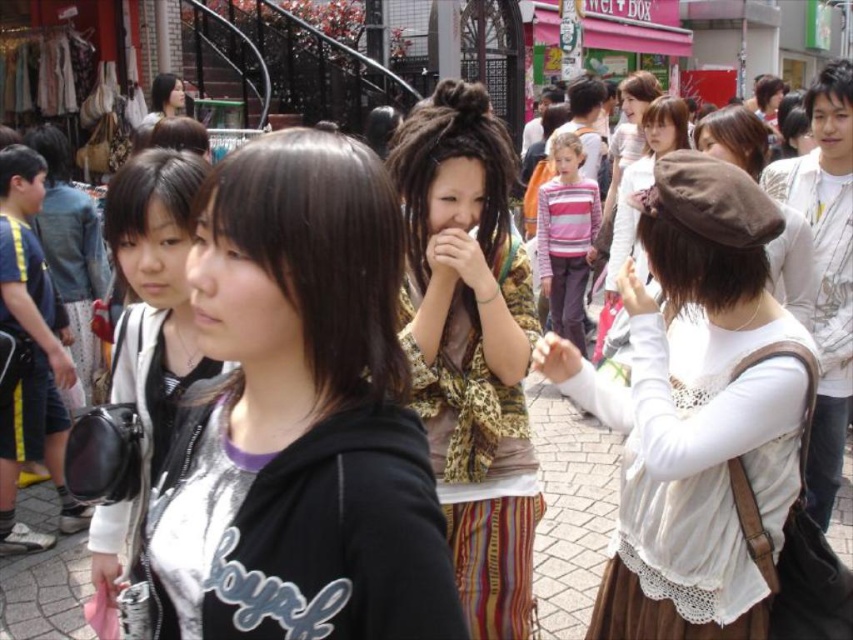
You are a photographer trying to capture a group photo of the black hoodie at center and the white lace blouse at center. If you want to ensure both subjects are fully visible in the frame without cropping, which subject should you position closer to the camera to avoid overcrowding?

The black hoodie at center might be wider than the white lace blouse at center, so positioning the black hoodie at center closer to the camera would help ensure both are fully visible without overcrowding.

You are a delivery person who needs to place a package between the white lace blouse at center and the matte black bag at left. The package requires a minimum of 16 meters of space. Can you fit it between them?

The distance between the white lace blouse at center and the matte black bag at left is 15.91 meters, which is less than the required 16 meters. Therefore, the package cannot be placed between them.